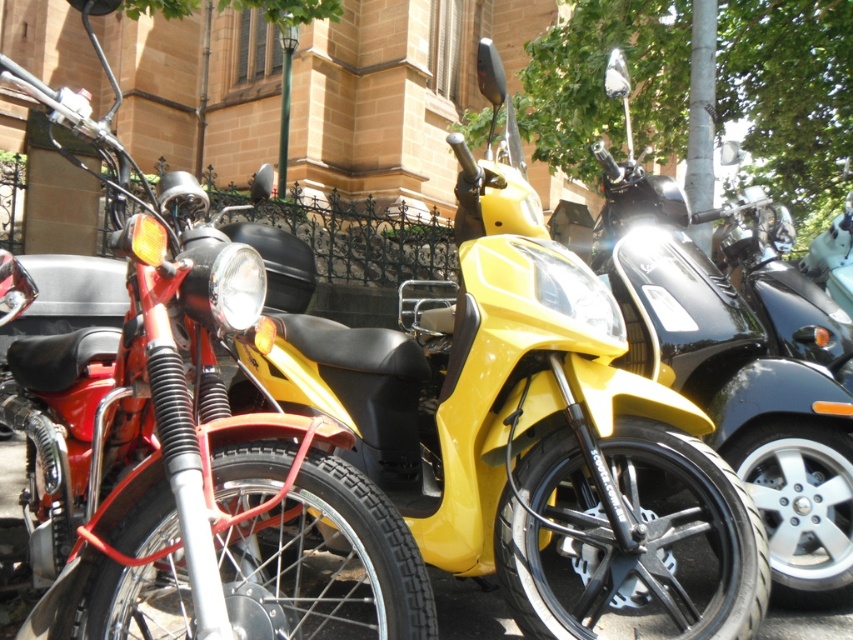
Who is higher up, yellow matte scooter at center or matte black motorcycle at left?

yellow matte scooter at center is above.

Is yellow matte scooter at center positioned behind matte black motorcycle at left?

Yes, yellow matte scooter at center is behind matte black motorcycle at left.

Does point (485, 294) come in front of point (154, 400)?

That is False.

Locate an element on the screen. yellow matte scooter at center is located at coordinates (531, 436).

Which is below, matte black motorcycle at left or shiny black scooter at center?

matte black motorcycle at left is lower down.

Locate an element on the screen. The image size is (853, 640). matte black motorcycle at left is located at coordinates (193, 452).

I want to click on matte black motorcycle at left, so click(x=193, y=452).

Can you confirm if yellow matte scooter at center is positioned above shiny black scooter at center?

No, yellow matte scooter at center is not above shiny black scooter at center.

Is yellow matte scooter at center to the right of shiny black scooter at center from the viewer's perspective?

Incorrect, yellow matte scooter at center is not on the right side of shiny black scooter at center.

Between point (567, 412) and point (613, 200), which one is positioned in front?

Point (567, 412) is in front.

Where is `yellow matte scooter at center`? This screenshot has width=853, height=640. yellow matte scooter at center is located at coordinates (531, 436).